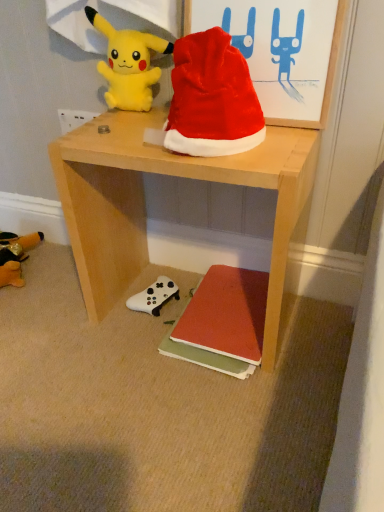
I want to click on vacant area on top of red matte book at lower center (from a real-world perspective), so click(x=233, y=302).